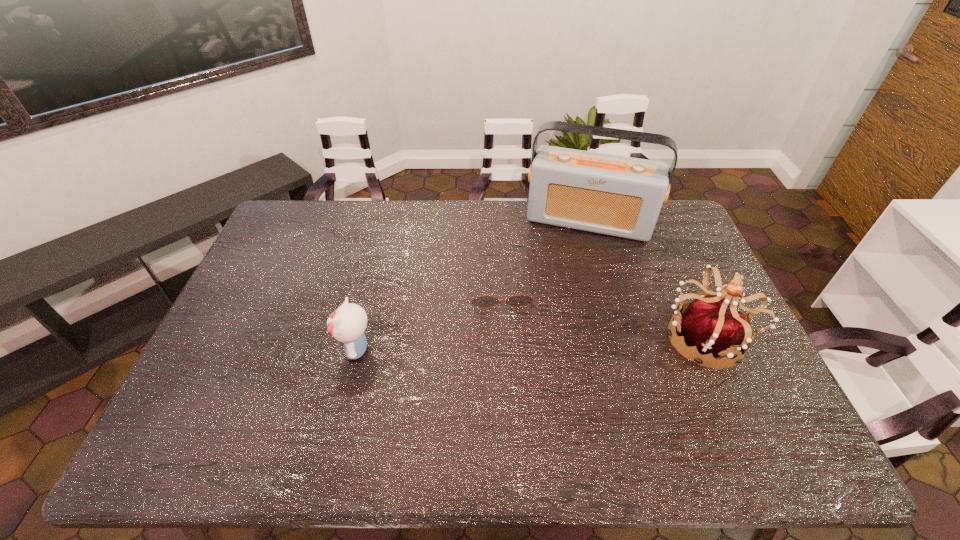
Identify the location of the third tallest object. This screenshot has height=540, width=960. (347, 324).

Locate an element on the screen. This screenshot has width=960, height=540. kitten is located at coordinates (347, 324).

You are a GUI agent. You are given a task and a screenshot of the screen. Output one action in this format:
    pyautogui.click(x=<x>, y=<y>)
    Task: Click on the second tallest object
    This screenshot has height=540, width=960.
    Given the screenshot: What is the action you would take?
    pyautogui.click(x=708, y=324)

Image resolution: width=960 pixels, height=540 pixels. In order to click on radio receiver in this screenshot , I will do `click(621, 196)`.

Image resolution: width=960 pixels, height=540 pixels. I want to click on the tallest object, so click(621, 196).

You are a GUI agent. You are given a task and a screenshot of the screen. Output one action in this format:
    pyautogui.click(x=<x>, y=<y>)
    Task: Click on the second object from left to right
    
    Given the screenshot: What is the action you would take?
    pyautogui.click(x=517, y=300)

At what (x,y) coordinates should I click in order to perform the action: click on sunglasses. Please return your answer as a coordinate pair (x, y). The image size is (960, 540). Looking at the image, I should click on (517, 300).

I want to click on vacant area located on the front-facing side of the second shortest object, so click(216, 349).

This screenshot has width=960, height=540. What are the coordinates of `free space located on the front-facing side of the second shortest object` in the screenshot? It's located at (321, 349).

Locate an element on the screen. This screenshot has width=960, height=540. vacant point located on the front-facing side of the second shortest object is located at coordinates (227, 349).